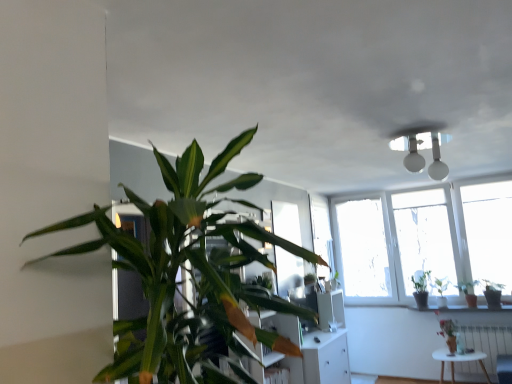
Describe the element at coordinates (441, 290) in the screenshot. I see `green glossy plant at upper right, the second houseplant from the back` at that location.

The height and width of the screenshot is (384, 512). Find the location of `white metallic radiator at lower right`. white metallic radiator at lower right is located at coordinates (489, 344).

You are a GUI agent. You are given a task and a screenshot of the screen. Output one action in this format:
    pyautogui.click(x=<x>, y=<y>)
    Task: Click on the green glossy houseplant at lower right, placed as the fifth houseplant when sorted from back to front
    The width and height of the screenshot is (512, 384).
    Given the screenshot: What is the action you would take?
    pyautogui.click(x=449, y=334)

The width and height of the screenshot is (512, 384). What do you see at coordinates (469, 292) in the screenshot? I see `green glossy plant at right, placed as the 4th houseplant when sorted from front to back` at bounding box center [469, 292].

I want to click on green leafy plant at left, the 1th houseplant viewed from the left, so click(192, 267).

From the image's perspective, count 2nd houseplants upward from the white matte table at lower right and point to it. Please provide its 2D coordinates.

[(421, 289)]

Is green glossy plant at right, positioned as the fifth houseplant in right-to-left order, to the left or to the right of white matte table at lower right in the image?

From the image, it's evident that green glossy plant at right, positioned as the fifth houseplant in right-to-left order, is to the left of white matte table at lower right.

Is white matte table at lower right a part of green glossy plant at right, positioned as the fifth houseplant in right-to-left order?

Definitely not — white matte table at lower right is not inside green glossy plant at right, positioned as the fifth houseplant in right-to-left order.

Does green glossy plant at right, the sixth houseplant positioned from the front, turn towards white matte table at lower right?

No, green glossy plant at right, the sixth houseplant positioned from the front, is not turned towards white matte table at lower right.

From the image's perspective, which is below, white matte table at lower right or green glossy plant at right, positioned as the fifth houseplant in right-to-left order?

From the image's view, white matte table at lower right is below.

Based on their sizes in the image, would you say white matte table at lower right is bigger or smaller than green glossy plant at right, the 2th houseplant when ordered from left to right?

white matte table at lower right is bigger than green glossy plant at right, the 2th houseplant when ordered from left to right.

Could you measure the distance between white matte table at lower right and green glossy plant at right, acting as the first houseplant starting from the back?

white matte table at lower right and green glossy plant at right, acting as the first houseplant starting from the back, are 26.83 inches apart.

Is green glossy plant at right, which ranks as the second houseplant in right-to-left order, completely or partially outside of green leafy plant at left, which is the 1th houseplant from front to back?

Yes.

Between point (475, 282) and point (240, 242), which one is positioned in front?

The point (240, 242) is more forward.

Between green glossy plant at right, the 3th houseplant from the back, and green leafy plant at left, which is the 1th houseplant from front to back, which one appears on the left side from the viewer's perspective?

From the viewer's perspective, green leafy plant at left, which is the 1th houseplant from front to back, appears more on the left side.

Is green glossy plant at right, placed as the 4th houseplant when sorted from front to back, facing away from green leafy plant at left, the 6th houseplant when ordered from back to front?

No, green glossy plant at right, placed as the 4th houseplant when sorted from front to back, is not facing away from green leafy plant at left, the 6th houseplant when ordered from back to front.

Which object is further away from the camera, green glossy plant at right, which is the third houseplant in front-to-back order, or white matte table at lower right?

green glossy plant at right, which is the third houseplant in front-to-back order, is further from the camera.

Is green glossy plant at right, which is the third houseplant in front-to-back order, with white matte table at lower right?

No, green glossy plant at right, which is the third houseplant in front-to-back order, is not beside white matte table at lower right.

Which of these two, green glossy plant at right, arranged as the 1th houseplant when viewed from the right, or white matte table at lower right, is wider?

white matte table at lower right.

Is green glossy plant at right, arranged as the 1th houseplant when viewed from the right, oriented away from white matte table at lower right?

No, green glossy plant at right, arranged as the 1th houseplant when viewed from the right, is not facing away from white matte table at lower right.

Is white matte table at lower right spatially inside white metallic radiator at lower right, or outside of it?

white matte table at lower right is not enclosed by white metallic radiator at lower right.

How distant is white matte table at lower right from white metallic radiator at lower right?

A distance of 5.53 inches exists between white matte table at lower right and white metallic radiator at lower right.

Looking at this image, are white matte table at lower right and white metallic radiator at lower right located far from each other?

They are positioned close to each other.

Is white metallic radiator at lower right at the back of green glossy houseplant at lower right, the third houseplant in the left-to-right sequence?

No, green glossy houseplant at lower right, the third houseplant in the left-to-right sequence, is not facing the opposite direction of white metallic radiator at lower right.

Is the surface of green glossy houseplant at lower right, the third houseplant in the left-to-right sequence, in direct contact with white metallic radiator at lower right?

No.

Is point (440, 321) in front of point (462, 331)?

No, (440, 321) is further to viewer.

Starting from the white metallic radiator at lower right, which houseplant is the 3rd one to the left? Please provide its 2D coordinates.

[(449, 334)]

Does green glossy plant at upper right, the second houseplant from the back, come behind white metallic radiator at lower right?

Yes, the depth of green glossy plant at upper right, the second houseplant from the back, is greater than that of white metallic radiator at lower right.

You are a GUI agent. You are given a task and a screenshot of the screen. Output one action in this format:
    pyautogui.click(x=<x>, y=<y>)
    Task: Click on the houseplant that is the 3rd one when counting backward from the white metallic radiator at lower right
    
    Given the screenshot: What is the action you would take?
    pyautogui.click(x=441, y=290)

In the scene shown: From the image's perspective, which object appears higher, green glossy plant at upper right, which ranks as the 3th houseplant in right-to-left order, or white metallic radiator at lower right?

green glossy plant at upper right, which ranks as the 3th houseplant in right-to-left order.

What's the angular difference between green glossy plant at upper right, the second houseplant from the back, and white metallic radiator at lower right's facing directions?

green glossy plant at upper right, the second houseplant from the back, and white metallic radiator at lower right are facing 5.13 degrees away from each other.

This screenshot has width=512, height=384. Identify the location of the 4th houseplant positioned above the white matte table at lower right (from a real-world perspective). (421, 289).

Locate an element on the screen. Image resolution: width=512 pixels, height=384 pixels. the 5th houseplant behind the white matte table at lower right, counting from the anchor's position is located at coordinates (421, 289).

Based on their spatial positions, is green glossy plant at right, which is the third houseplant in front-to-back order, or white metallic radiator at lower right closer to green glossy plant at right, acting as the first houseplant starting from the back?

green glossy plant at right, which is the third houseplant in front-to-back order, lies closer to green glossy plant at right, acting as the first houseplant starting from the back, than the other object.

Which object lies further to the anchor point green glossy plant at right, the 2th houseplant when ordered from left to right, green leafy plant at left, which is counted as the 6th houseplant, starting from the right, or green glossy houseplant at lower right, placed as the fifth houseplant when sorted from back to front?

green leafy plant at left, which is counted as the 6th houseplant, starting from the right, lies further to green glossy plant at right, the 2th houseplant when ordered from left to right, than the other object.

Based on their spatial positions, is white metallic radiator at lower right or green glossy plant at right, arranged as the 1th houseplant when viewed from the right, closer to green glossy plant at upper right, arranged as the 5th houseplant when viewed from the front?

Among the two, green glossy plant at right, arranged as the 1th houseplant when viewed from the right, is located nearer to green glossy plant at upper right, arranged as the 5th houseplant when viewed from the front.

Considering their positions, is green glossy plant at right, placed as the 4th houseplant when sorted from front to back, positioned further to green glossy houseplant at lower right, the third houseplant in the left-to-right sequence, than white metallic radiator at lower right?

green glossy plant at right, placed as the 4th houseplant when sorted from front to back, is positioned further to the anchor green glossy houseplant at lower right, the third houseplant in the left-to-right sequence.

Looking at the image, which one is located closer to green glossy plant at upper right, arranged as the 5th houseplant when viewed from the front, white matte table at lower right or green glossy houseplant at lower right, placed as the fifth houseplant when sorted from back to front?

The object closer to green glossy plant at upper right, arranged as the 5th houseplant when viewed from the front, is green glossy houseplant at lower right, placed as the fifth houseplant when sorted from back to front.

Looking at the image, which one is located closer to green glossy plant at right, arranged as the 1th houseplant when viewed from the right, green glossy plant at upper right, arranged as the 5th houseplant when viewed from the front, or green glossy plant at right, the 3th houseplant from the back?

green glossy plant at right, the 3th houseplant from the back, lies closer to green glossy plant at right, arranged as the 1th houseplant when viewed from the right, than the other object.

When comparing their distances from green glossy houseplant at lower right, the third houseplant in the left-to-right sequence, does green glossy plant at upper right, the second houseplant from the back, or green glossy plant at right, which ranks as the second houseplant in right-to-left order, seem further?

green glossy plant at right, which ranks as the second houseplant in right-to-left order, is positioned further to the anchor green glossy houseplant at lower right, the third houseplant in the left-to-right sequence.

From the image, which object appears to be farther from green leafy plant at left, the 1th houseplant viewed from the left, green glossy plant at right, the 4th houseplant from the back, or green glossy plant at upper right, the second houseplant from the back?

Based on the image, green glossy plant at upper right, the second houseplant from the back, appears to be further to green leafy plant at left, the 1th houseplant viewed from the left.

You are a GUI agent. You are given a task and a screenshot of the screen. Output one action in this format:
    pyautogui.click(x=<x>, y=<y>)
    Task: Click on the table between green leafy plant at left, the 6th houseplant when ordered from back to front, and green glossy houseplant at lower right, which is counted as the 4th houseplant, starting from the right, in the front-back direction
    
    Given the screenshot: What is the action you would take?
    pyautogui.click(x=458, y=361)

This screenshot has width=512, height=384. Identify the location of table between green leafy plant at left, the 6th houseplant when ordered from back to front, and white metallic radiator at lower right in the front-back direction. (458, 361).

Identify the location of radiator between green leafy plant at left, which is counted as the 6th houseplant, starting from the right, and green glossy plant at upper right, which ranks as the 3th houseplant in right-to-left order, in the front-back direction. The height and width of the screenshot is (384, 512). (489, 344).

I want to click on table positioned between green leafy plant at left, which is the 1th houseplant from front to back, and green glossy plant at right, placed as the 4th houseplant when sorted from front to back, from near to far, so click(458, 361).